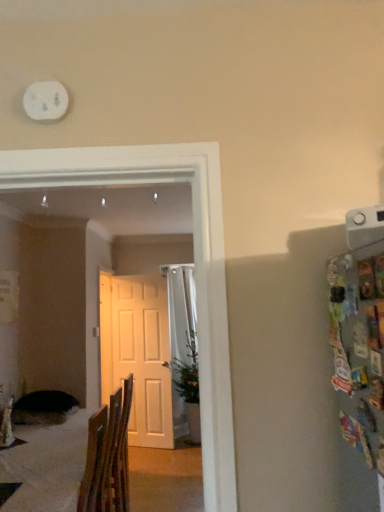
The image size is (384, 512). I want to click on wooden chair at lower left, so click(x=108, y=456).

In the scene shown: Which object is wider, green leafy plant at center or wooden chair at lower left?

wooden chair at lower left is wider.

Is wooden chair at lower left a part of green leafy plant at center?

No, wooden chair at lower left is not surrounded by green leafy plant at center.

From the image's perspective, does green leafy plant at center appear lower than wooden chair at lower left?

Yes, from the image's perspective, green leafy plant at center is below wooden chair at lower left.

Is point (192, 410) closer or farther from the camera than point (78, 496)?

Point (192, 410) appears to be farther away from the viewer than point (78, 496).

From a real-world perspective, relative to white matte door at center, is green leafy plant at center vertically above or below?

green leafy plant at center is below white matte door at center.

Are green leafy plant at center and white matte door at center beside each other?

No, green leafy plant at center is not next to white matte door at center.

Find the location of `houseplant located on the right of white matte door at center`. houseplant located on the right of white matte door at center is located at coordinates (189, 389).

Which object is positioned more to the left, wooden chair at lower left or white matte clock at upper left?

Positioned to the left is wooden chair at lower left.

Is white matte clock at upper left at the back of wooden chair at lower left?

No, white matte clock at upper left is not at the back of wooden chair at lower left.

Where is `clock located in front of the wooden chair at lower left`? clock located in front of the wooden chair at lower left is located at coordinates [46, 101].

Would you say white matte door at center is inside or outside green leafy plant at center?

white matte door at center is spatially situated outside green leafy plant at center.

Considering the sizes of objects white matte door at center and green leafy plant at center in the image provided, who is smaller, white matte door at center or green leafy plant at center?

white matte door at center.

Which is closer to the camera, (x=151, y=351) or (x=188, y=389)?

Point (x=151, y=351).

From their relative heights in the image, would you say white matte door at center is taller or shorter than green leafy plant at center?

Considering their sizes, white matte door at center has more height than green leafy plant at center.

Can you confirm if white matte door at center is taller than white matte clock at upper left?

Yes.

Considering the sizes of objects white matte door at center and white matte clock at upper left in the image provided, who is thinner, white matte door at center or white matte clock at upper left?

Thinner between the two is white matte clock at upper left.

Who is more distant, white matte door at center or white matte clock at upper left?

white matte door at center is behind.

Would you say white matte door at center is to the left or to the right of white matte clock at upper left in the picture?

From the image, it's evident that white matte door at center is to the left of white matte clock at upper left.

Consider the image. Is wooden chair at lower left beside white matte door at center?

wooden chair at lower left and white matte door at center are not in contact.

Is wooden chair at lower left inside the boundaries of white matte door at center, or outside?

wooden chair at lower left is not enclosed by white matte door at center.

You are a GUI agent. You are given a task and a screenshot of the screen. Output one action in this format:
    pyautogui.click(x=<x>, y=<y>)
    Task: Click on the door located above the wooden chair at lower left (from the image's perspective)
    The image size is (384, 512).
    Given the screenshot: What is the action you would take?
    pyautogui.click(x=138, y=353)

How much distance is there between wooden chair at lower left and white matte door at center?

They are 2.27 meters apart.

Which is further, (109, 319) or (129, 376)?

Positioned behind is point (109, 319).

This screenshot has width=384, height=512. I want to click on chair on the left side of white matte door at center, so click(x=108, y=456).

Based on the photo, from a real-world perspective, which object stands above the other?

white matte door at center is physically above.

Is the depth of white matte door at center greater than that of wooden chair at lower left?

Yes, white matte door at center is further from the viewer.

Locate an element on the screen. The height and width of the screenshot is (512, 384). houseplant located behind the wooden chair at lower left is located at coordinates (189, 389).

I want to click on door to the left of green leafy plant at center, so click(x=138, y=353).

Which object lies further to the anchor point wooden chair at lower left, green leafy plant at center or white matte clock at upper left?

green leafy plant at center.

Estimate the real-world distances between objects in this image. Which object is closer to green leafy plant at center, white matte door at center or white matte clock at upper left?

The object closer to green leafy plant at center is white matte door at center.

From the image, which object appears to be farther from wooden chair at lower left, white matte door at center or green leafy plant at center?

white matte door at center is positioned further to the anchor wooden chair at lower left.

Looking at the image, which one is located closer to wooden chair at lower left, white matte clock at upper left or green leafy plant at center?

white matte clock at upper left lies closer to wooden chair at lower left than the other object.

When comparing their distances from white matte clock at upper left, does wooden chair at lower left or white matte door at center seem closer?

wooden chair at lower left lies closer to white matte clock at upper left than the other object.

Estimate the real-world distances between objects in this image. Which object is closer to green leafy plant at center, white matte clock at upper left or wooden chair at lower left?

The object closer to green leafy plant at center is wooden chair at lower left.

Which object lies further to the anchor point white matte clock at upper left, wooden chair at lower left or green leafy plant at center?

The object further to white matte clock at upper left is green leafy plant at center.

Estimate the real-world distances between objects in this image. Which object is further from green leafy plant at center, white matte door at center or wooden chair at lower left?

Among the two, wooden chair at lower left is located further to green leafy plant at center.

Locate an element on the screen. The image size is (384, 512). chair located between white matte clock at upper left and green leafy plant at center in the depth direction is located at coordinates (108, 456).

I want to click on door between white matte clock at upper left and green leafy plant at center from front to back, so click(138, 353).

Identify the location of door located between wooden chair at lower left and green leafy plant at center in the depth direction. Image resolution: width=384 pixels, height=512 pixels. (138, 353).

You are a GUI agent. You are given a task and a screenshot of the screen. Output one action in this format:
    pyautogui.click(x=<x>, y=<y>)
    Task: Click on the chair between white matte clock at upper left and white matte door at center along the z-axis
    
    Given the screenshot: What is the action you would take?
    pyautogui.click(x=108, y=456)